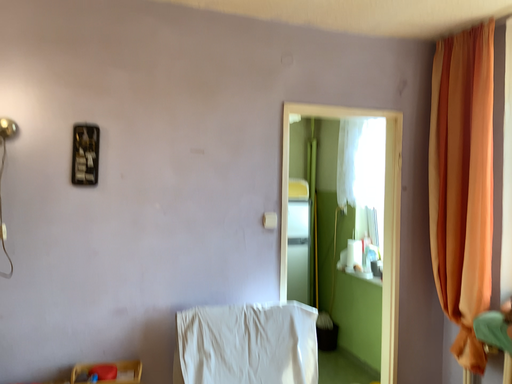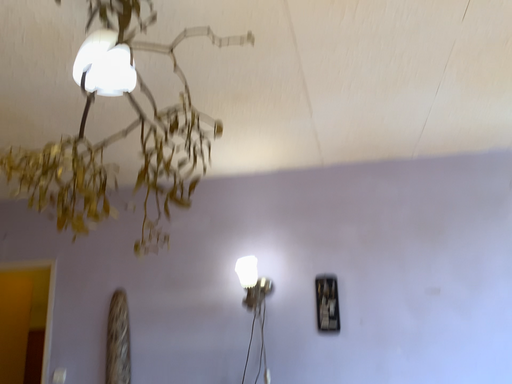
Question: Which way did the camera rotate in the video?

Choices:
 (A) rotated upward
 (B) rotated downward

Answer: (A)